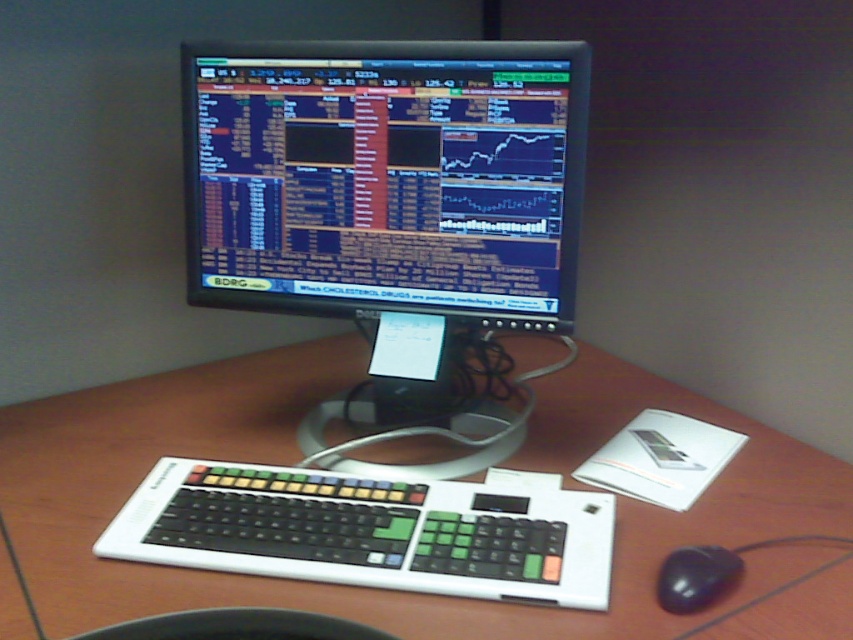
Question: Does brown wood table at center come in front of black rubber mouse at lower right?

Choices:
 (A) no
 (B) yes

Answer: (B)

Question: Among these objects, which one is farthest from the camera?

Choices:
 (A) black rubber mouse at lower right
 (B) brown wood table at center
 (C) black glossy monitor at center

Answer: (C)

Question: Which point is farther to the camera?

Choices:
 (A) black plastic bowl at lower center
 (B) brown wood table at center
 (C) black glossy monitor at center

Answer: (C)

Question: Which point is farther to the camera?

Choices:
 (A) (445, 616)
 (B) (689, 609)
 (C) (196, 476)

Answer: (C)

Question: Is black glossy monitor at center wider than black plastic bowl at lower center?

Choices:
 (A) yes
 (B) no

Answer: (A)

Question: Does black glossy monitor at center have a smaller size compared to black plastic bowl at lower center?

Choices:
 (A) no
 (B) yes

Answer: (A)